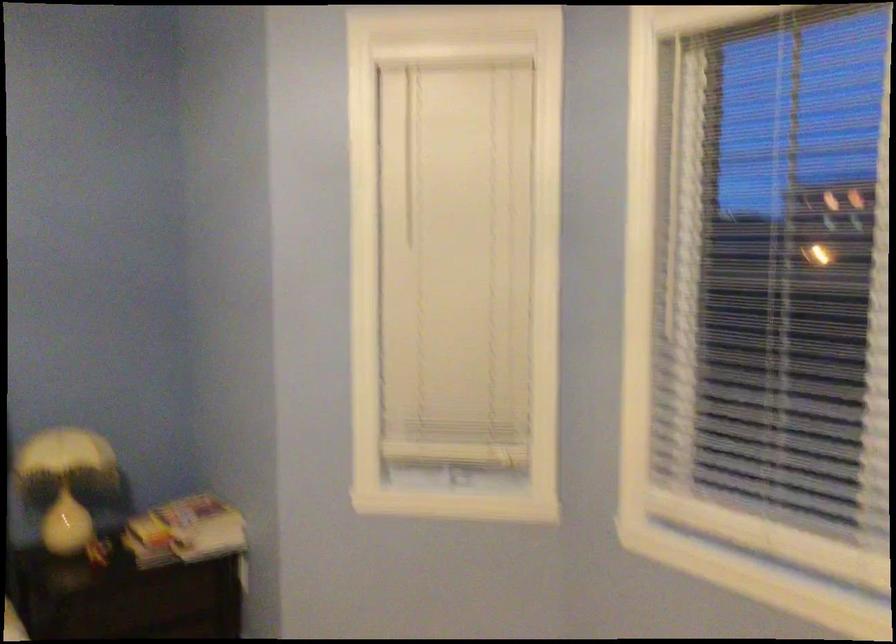
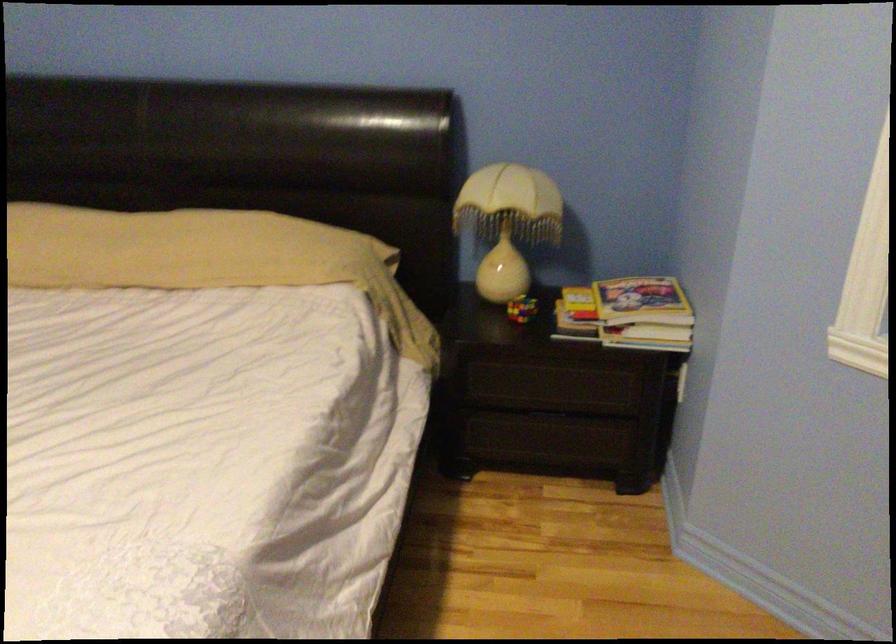
Find the pixel in the second image that matches [204,514] in the first image.

(642, 301)